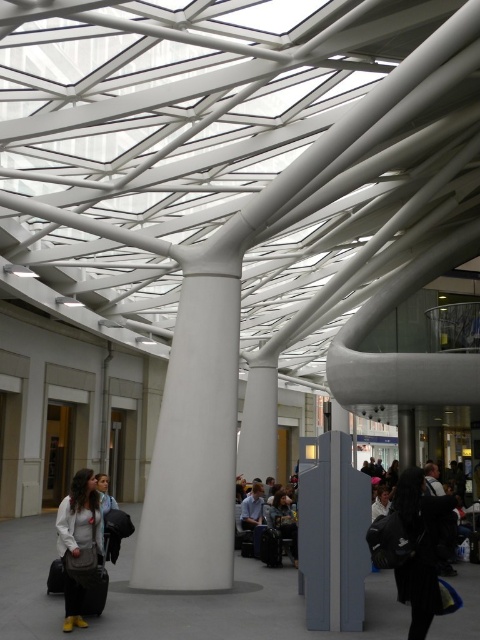
Is matte white jacket at lower left closer to the viewer compared to dark brown leather jacket at center?

Yes, matte white jacket at lower left is closer to the viewer.

Between point (83, 468) and point (268, 516), which one is positioned behind?

Positioned behind is point (268, 516).

Image resolution: width=480 pixels, height=640 pixels. Find the location of `matte white jacket at lower left`. matte white jacket at lower left is located at coordinates (79, 544).

Does black fuzzy coat at lower right appear on the left side of matte white jacket at lower left?

Incorrect, black fuzzy coat at lower right is not on the left side of matte white jacket at lower left.

Where is `black fuzzy coat at lower right`? The width and height of the screenshot is (480, 640). black fuzzy coat at lower right is located at coordinates (414, 547).

Does point (396, 524) lie behind point (76, 582)?

That is False.

The height and width of the screenshot is (640, 480). In order to click on black fuzzy coat at lower right in this screenshot , I will do `click(414, 547)`.

Does black fuzzy coat at lower right come in front of dark brown leather jacket at center?

That is True.

Does point (416, 605) come closer to viewer compared to point (279, 515)?

Yes, point (416, 605) is in front of point (279, 515).

Between point (396, 534) and point (288, 497), which one is positioned behind?

The point (288, 497) is behind.

Image resolution: width=480 pixels, height=640 pixels. What are the coordinates of `black fuzzy coat at lower right` in the screenshot? It's located at (414, 547).